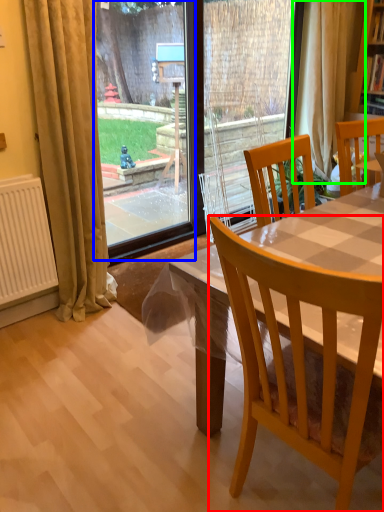
Question: Which object is the farthest from chair (highlighted by a red box)? Choose among these: glass door (highlighted by a blue box) or curtain (highlighted by a green box).

Choices:
 (A) glass door
 (B) curtain

Answer: (A)